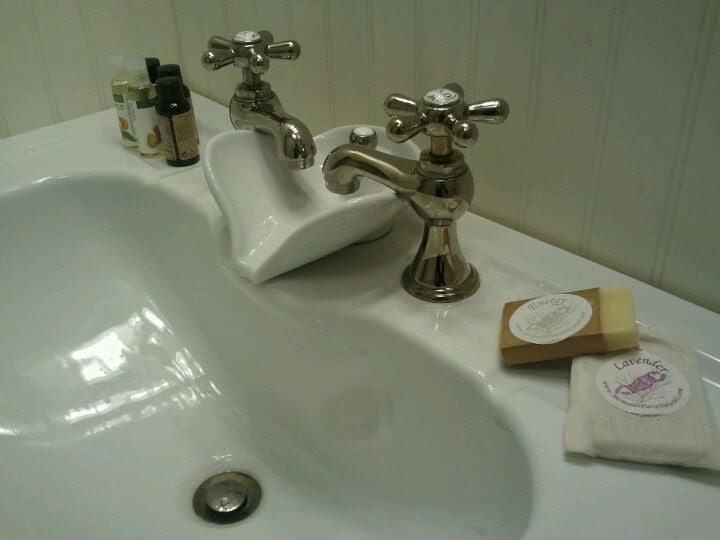
In order to click on the left handle in this screenshot , I will do `click(248, 48)`.